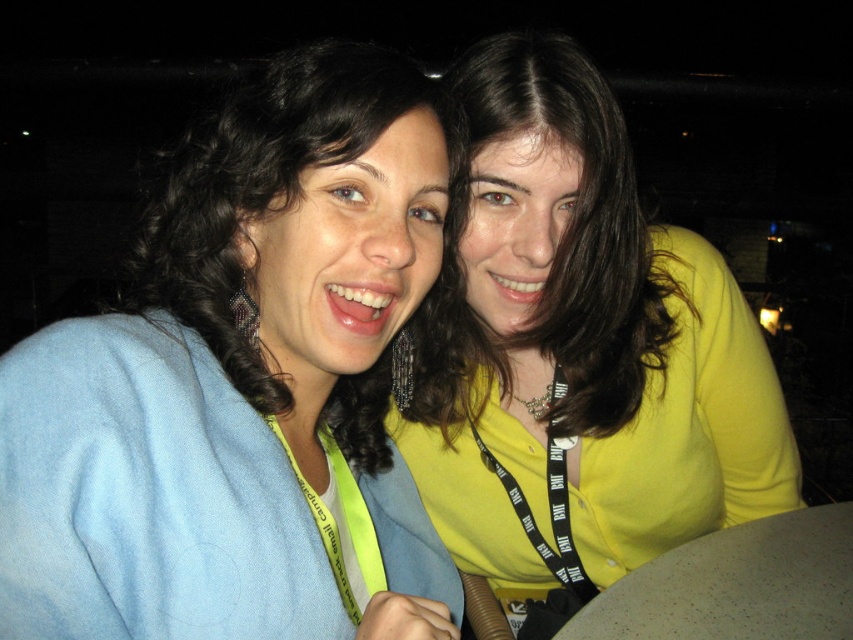
Can you confirm if blue fabric at left is thinner than yellow matte shirt at upper right?

Correct, blue fabric at left's width is less than yellow matte shirt at upper right's.

Identify the location of blue fabric at left. (242, 387).

Image resolution: width=853 pixels, height=640 pixels. What are the coordinates of `blue fabric at left` in the screenshot? It's located at (242, 387).